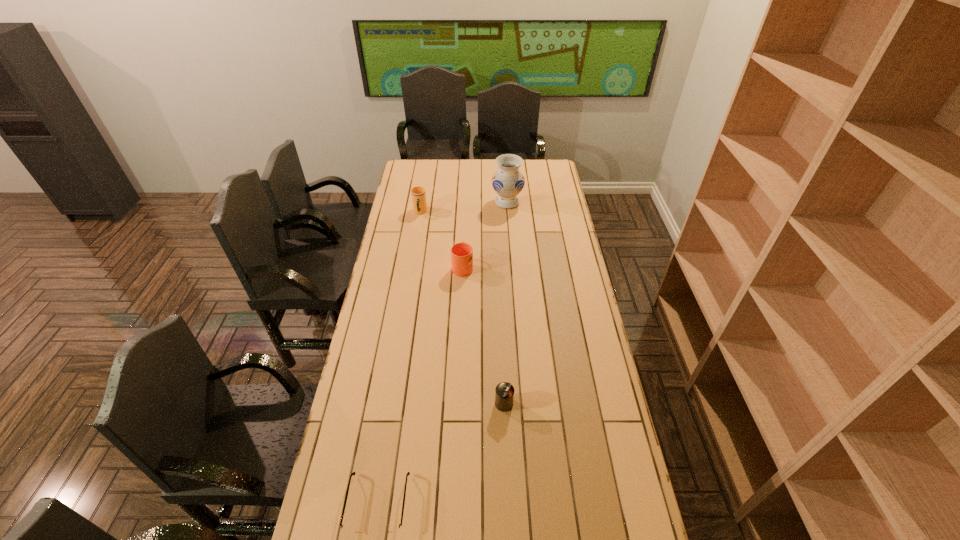
I want to click on vacant space located 0.080m on the handle side of the mug, so [x=464, y=245].

You are a GUI agent. You are given a task and a screenshot of the screen. Output one action in this format:
    pyautogui.click(x=<x>, y=<y>)
    Task: Click on the vacant space located 0.110m on the handle side of the mug
    
    Given the screenshot: What is the action you would take?
    pyautogui.click(x=464, y=241)

The width and height of the screenshot is (960, 540). Find the location of `free space located 0.080m on the left of the can`. free space located 0.080m on the left of the can is located at coordinates (471, 403).

Image resolution: width=960 pixels, height=540 pixels. Identify the location of cup that is at the left edge. tap(418, 194).

Locate an element on the screen. This screenshot has height=540, width=960. spectacles that is at the left edge is located at coordinates (388, 529).

This screenshot has height=540, width=960. In the image, there is a desktop. Find the location of `vacant space at the left edge`. vacant space at the left edge is located at coordinates (386, 246).

Find the location of a particular element. Image resolution: width=960 pixels, height=540 pixels. blank space at the right edge is located at coordinates (537, 189).

You are a GUI agent. You are given a task and a screenshot of the screen. Output one action in this format:
    pyautogui.click(x=<x>, y=<y>)
    Task: Click on the free point at the far left corner
    The image size is (960, 540).
    Given the screenshot: What is the action you would take?
    pyautogui.click(x=418, y=160)

At what (x,y) coordinates should I click in order to perform the action: click on free space between the nearest object and the cup. Please return your answer as a coordinate pair (x, y). The height and width of the screenshot is (540, 960). Looking at the image, I should click on [x=399, y=358].

Locate an element on the screen. The image size is (960, 540). vacant area that lies between the tallest object and the cup is located at coordinates (464, 207).